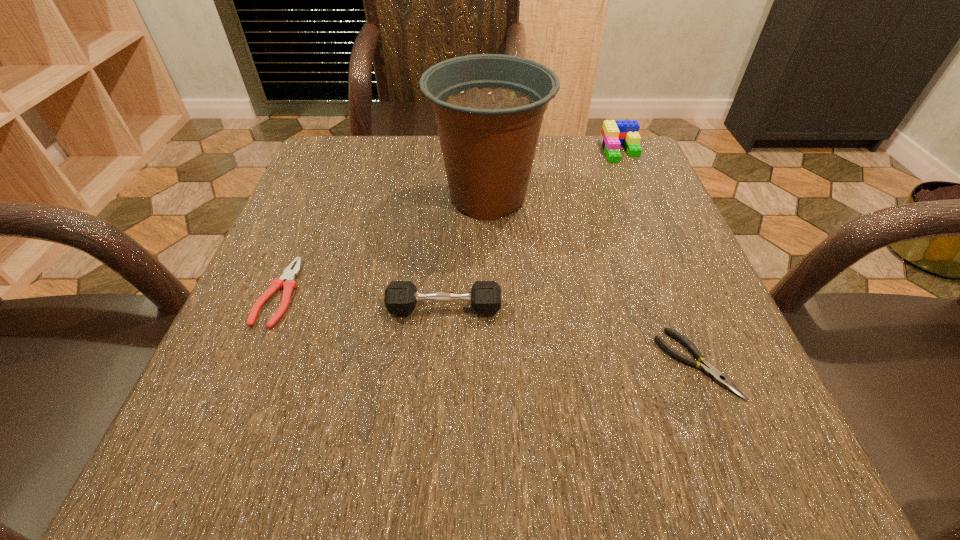
Identify the location of vacant space at the near edge. Image resolution: width=960 pixels, height=540 pixels. (359, 485).

Find the location of a particular element. vacant space at the left edge is located at coordinates (313, 221).

Identify the location of free space at the right edge. The height and width of the screenshot is (540, 960). (653, 205).

Identify the location of blank space at the far left corner. The height and width of the screenshot is (540, 960). (318, 190).

The width and height of the screenshot is (960, 540). In the image, there is a desktop. Identify the location of free region at the far right corner. (609, 167).

Locate an element on the screen. The width and height of the screenshot is (960, 540). free spot between the Lego and the nearest object is located at coordinates (659, 257).

The height and width of the screenshot is (540, 960). Identify the location of vacant area between the left pliers and the flowerpot. (383, 245).

At what (x,y) coordinates should I click in order to perform the action: click on free point between the tallest object and the nearest object. Please return your answer as a coordinate pair (x, y). The image size is (960, 540). Looking at the image, I should click on (592, 281).

Identify the location of free area in between the farther pliers and the right pliers. (488, 328).

Locate an element on the screen. Image resolution: width=960 pixels, height=540 pixels. free space between the leftmost object and the right pliers is located at coordinates (488, 328).